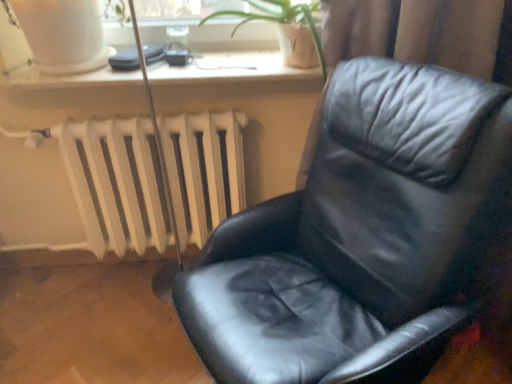
Measure the distance between point (289,4) and camera.

Point (289,4) and camera are 1.34 meters apart.

Describe the element at coordinates (278, 20) in the screenshot. I see `green leafy plant at upper center` at that location.

What are the coordinates of `white plastic window sill at upper center` in the screenshot? It's located at (239, 74).

Where is `white matte radiator at lower left`? The width and height of the screenshot is (512, 384). white matte radiator at lower left is located at coordinates (116, 184).

Locate an element on the screen. The image size is (512, 384). green leafy plant at upper center is located at coordinates (278, 20).

In the image, is white matte radiator at lower left on the left side or the right side of white plastic window sill at upper center?

Clearly, white matte radiator at lower left is on the left of white plastic window sill at upper center in the image.

From the picture: Is white matte radiator at lower left facing towards white plastic window sill at upper center?

No, white matte radiator at lower left is not facing towards white plastic window sill at upper center.

Is white matte radiator at lower left far away from white plastic window sill at upper center?

That's not correct — white matte radiator at lower left is a little close to white plastic window sill at upper center.

Is white plastic window sill at upper center far from white matte radiator at lower left?

No, white plastic window sill at upper center is not far from white matte radiator at lower left.

Looking at this image, is white plastic window sill at upper center behind white matte radiator at lower left?

No, white plastic window sill at upper center is closer to the viewer.

How far apart are white plastic window sill at upper center and white matte radiator at lower left?

The distance of white plastic window sill at upper center from white matte radiator at lower left is 12.29 inches.

Consider the image. From the image's perspective, is white plastic window sill at upper center located above white matte radiator at lower left?

Yes.

Is green leafy plant at upper center next to white plastic window sill at upper center and touching it?

No, green leafy plant at upper center is not making contact with white plastic window sill at upper center.

How many degrees apart are the facing directions of green leafy plant at upper center and white plastic window sill at upper center?

The angle between the facing direction of green leafy plant at upper center and the facing direction of white plastic window sill at upper center is 0.00985 degrees.

From the picture: From the image's perspective, is green leafy plant at upper center over white plastic window sill at upper center?

Yes, from the image's perspective, green leafy plant at upper center is on top of white plastic window sill at upper center.

Between black leather chair at center and white plastic window sill at upper center, which one is positioned in front?

Positioned in front is black leather chair at center.

Which of these two, black leather chair at center or white plastic window sill at upper center, stands taller?

black leather chair at center.

In the scene shown: Looking at their sizes, would you say black leather chair at center is wider or thinner than white plastic window sill at upper center?

In the image, black leather chair at center appears to be wider than white plastic window sill at upper center.

Can you tell me how much black leather chair at center and white plastic window sill at upper center differ in facing direction?

black leather chair at center and white plastic window sill at upper center are facing 65.3 degrees away from each other.

Considering the sizes of green leafy plant at upper center and white matte radiator at lower left in the image, is green leafy plant at upper center bigger or smaller than white matte radiator at lower left?

In the image, green leafy plant at upper center appears to be smaller than white matte radiator at lower left.

Does point (232, 36) lie in front of point (165, 134)?

No, it is not.

Are green leafy plant at upper center and white matte radiator at lower left located far from each other?

green leafy plant at upper center is actually quite close to white matte radiator at lower left.

Based on the photo, considering the relative positions of white matte radiator at lower left and black leather chair at center in the image provided, is white matte radiator at lower left to the left of black leather chair at center from the viewer's perspective?

Correct, you'll find white matte radiator at lower left to the left of black leather chair at center.

In the scene shown: Is white matte radiator at lower left oriented towards black leather chair at center?

Yes, white matte radiator at lower left is turned towards black leather chair at center.

Is white matte radiator at lower left positioned before black leather chair at center?

No, the depth of white matte radiator at lower left is greater than that of black leather chair at center.

Is there a large distance between white matte radiator at lower left and black leather chair at center?

No, white matte radiator at lower left is in close proximity to black leather chair at center.

Does white plastic window sill at upper center have a smaller size compared to green leafy plant at upper center?

Yes, white plastic window sill at upper center is smaller than green leafy plant at upper center.

Considering the relative positions of white plastic window sill at upper center and green leafy plant at upper center in the image provided, is white plastic window sill at upper center to the right of green leafy plant at upper center from the viewer's perspective?

No.

The image size is (512, 384). Find the location of `plant lying in front of the white plastic window sill at upper center`. plant lying in front of the white plastic window sill at upper center is located at coordinates (278, 20).

From a real-world perspective, is white plastic window sill at upper center above or below green leafy plant at upper center?

white plastic window sill at upper center is situated lower than green leafy plant at upper center in the real world.

Find the location of a particular element. The width and height of the screenshot is (512, 384). window sill in front of the white matte radiator at lower left is located at coordinates pyautogui.click(x=239, y=74).

Where is `window sill that appears above the white matte radiator at lower left (from the image's perspective)`? This screenshot has height=384, width=512. window sill that appears above the white matte radiator at lower left (from the image's perspective) is located at coordinates (239, 74).

When comparing their distances from green leafy plant at upper center, does white matte radiator at lower left or black leather chair at center seem further?

black leather chair at center is positioned further to the anchor green leafy plant at upper center.

Looking at the image, which one is located further to white matte radiator at lower left, black leather chair at center or white plastic window sill at upper center?

Based on the image, black leather chair at center appears to be further to white matte radiator at lower left.

Looking at this image, which object lies further to the anchor point white matte radiator at lower left, black leather chair at center or green leafy plant at upper center?

green leafy plant at upper center is further to white matte radiator at lower left.

Which object lies further to the anchor point white matte radiator at lower left, white plastic window sill at upper center or black leather chair at center?

The object further to white matte radiator at lower left is black leather chair at center.

Looking at the image, which one is located further to white plastic window sill at upper center, black leather chair at center or green leafy plant at upper center?

The object further to white plastic window sill at upper center is black leather chair at center.

From the image, which object appears to be nearer to green leafy plant at upper center, white matte radiator at lower left or white plastic window sill at upper center?

white plastic window sill at upper center is positioned closer to the anchor green leafy plant at upper center.

Considering their positions, is white matte radiator at lower left positioned closer to black leather chair at center than green leafy plant at upper center?

white matte radiator at lower left is positioned closer to the anchor black leather chair at center.

From the image, which object appears to be farther from green leafy plant at upper center, white plastic window sill at upper center or white matte radiator at lower left?

white matte radiator at lower left is positioned further to the anchor green leafy plant at upper center.

The width and height of the screenshot is (512, 384). What are the coordinates of `plant between black leather chair at center and white matte radiator at lower left along the z-axis` in the screenshot? It's located at (278, 20).

Where is `plant between black leather chair at center and white plastic window sill at upper center from front to back`? plant between black leather chair at center and white plastic window sill at upper center from front to back is located at coordinates (278, 20).

You are a GUI agent. You are given a task and a screenshot of the screen. Output one action in this format:
    pyautogui.click(x=<x>, y=<y>)
    Task: Click on the window sill positioned between black leather chair at center and white matte radiator at lower left from near to far
    This screenshot has width=512, height=384.
    Given the screenshot: What is the action you would take?
    pyautogui.click(x=239, y=74)

Locate an element on the screen. The width and height of the screenshot is (512, 384). window sill between green leafy plant at upper center and white matte radiator at lower left in the up-down direction is located at coordinates (239, 74).